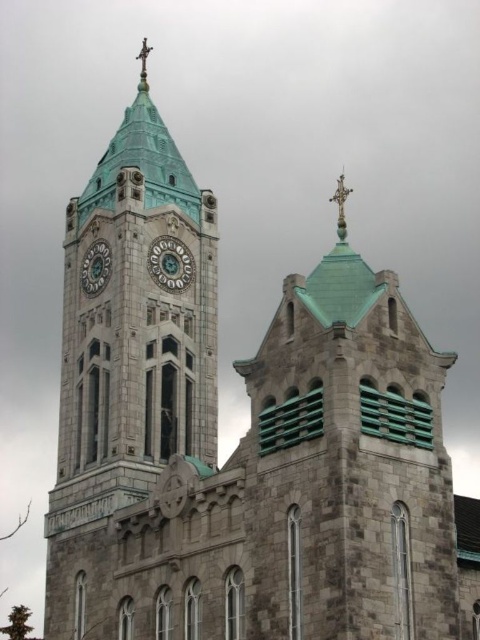
Looking at this image, does teal stone clock tower at center-left lie behind metallic cross at top?

No, teal stone clock tower at center-left is in front of metallic cross at top.

Is point (207, 264) behind point (142, 74)?

No, it is not.

Locate an element on the screen. This screenshot has height=640, width=480. teal stone clock tower at center-left is located at coordinates (134, 328).

Does teal stone clock tower at center-left have a smaller size compared to silver metallic cross at upper center?

Actually, teal stone clock tower at center-left might be larger than silver metallic cross at upper center.

Does point (197, 321) come behind point (347, 193)?

Yes, it is behind point (347, 193).

You are a GUI agent. You are given a task and a screenshot of the screen. Output one action in this format:
    pyautogui.click(x=<x>, y=<y>)
    Task: Click on the teal stone clock tower at center-left
    The height and width of the screenshot is (640, 480).
    Given the screenshot: What is the action you would take?
    pyautogui.click(x=134, y=328)

Is green stone clock at center thinner than green stone clock at upper left?

Incorrect, green stone clock at center's width is not less than green stone clock at upper left's.

Which is more to the right, green stone clock at center or green stone clock at upper left?

green stone clock at center is more to the right.

This screenshot has width=480, height=640. I want to click on green stone clock at center, so click(x=170, y=262).

This screenshot has width=480, height=640. Find the location of `green stone clock at center`. green stone clock at center is located at coordinates (170, 262).